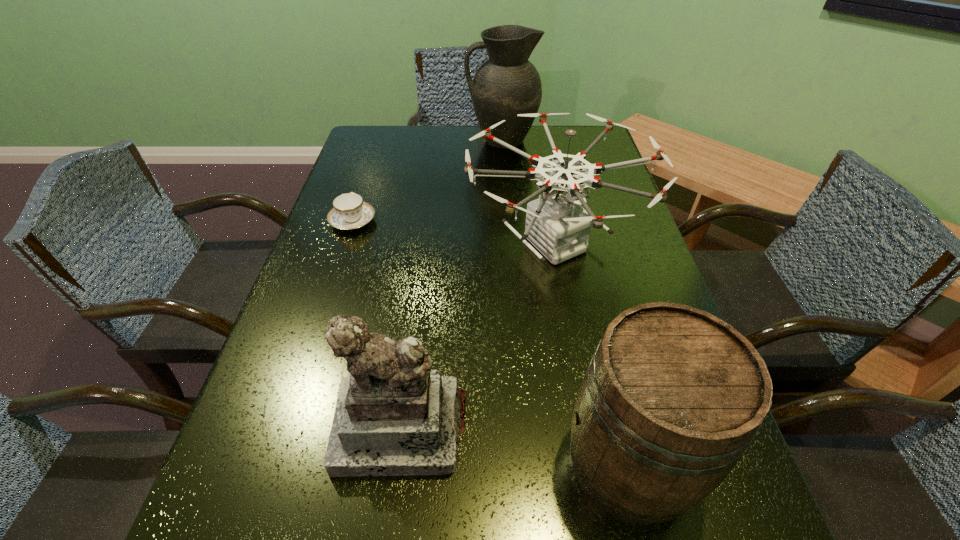
You are a GUI agent. You are given a task and a screenshot of the screen. Output one action in this format:
    pyautogui.click(x=<x>, y=<y>)
    Task: Click on the free space between the drone and the figurine
    
    Given the screenshot: What is the action you would take?
    pyautogui.click(x=477, y=336)

Image resolution: width=960 pixels, height=540 pixels. Identify the location of blank region between the leftmost object and the figurine. (377, 325).

Where is `unoccupied position between the cider and the figurine`? The height and width of the screenshot is (540, 960). unoccupied position between the cider and the figurine is located at coordinates (515, 447).

Locate an element on the screen. vacant space that is in between the figurine and the drone is located at coordinates (477, 336).

You are a GUI agent. You are given a task and a screenshot of the screen. Output one action in this format:
    pyautogui.click(x=<x>, y=<y>)
    Task: Click on the free space between the farthest object and the cider
    The height and width of the screenshot is (540, 960).
    Given the screenshot: What is the action you would take?
    pyautogui.click(x=564, y=302)

The width and height of the screenshot is (960, 540). Find the location of `vacant point located between the drone and the shortest object`. vacant point located between the drone and the shortest object is located at coordinates (453, 232).

Where is `free point between the drone and the farthest object`? The height and width of the screenshot is (540, 960). free point between the drone and the farthest object is located at coordinates (528, 192).

Select which object is the closest to the cider. Please provide its 2D coordinates. Your answer should be formatted as a tuple, i.e. [(x, y)], where the tuple contains the x and y coordinates of a point satisfying the conditions above.

[(394, 416)]

Identify which object is the third closest to the drone. Please provide its 2D coordinates. Your answer should be formatted as a tuple, i.e. [(x, y)], where the tuple contains the x and y coordinates of a point satisfying the conditions above.

[(672, 397)]

Where is `free spot that satisfies the following two spatial constraints: 1. on the side of the pitcher with the handle; 2. on the front-facing side of the figurine`? Image resolution: width=960 pixels, height=540 pixels. free spot that satisfies the following two spatial constraints: 1. on the side of the pitcher with the handle; 2. on the front-facing side of the figurine is located at coordinates (522, 429).